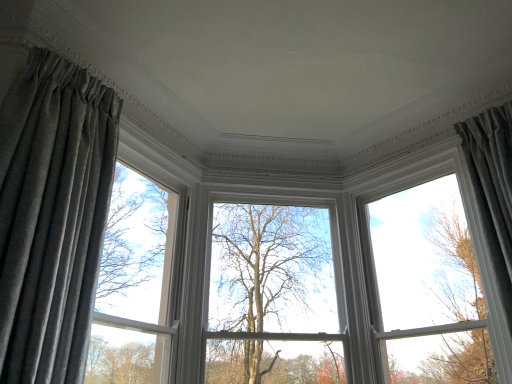
Question: Does matte gray curtain at left have a larger size compared to velvet gray curtain at left, the first curtain positioned from the left?

Choices:
 (A) no
 (B) yes

Answer: (A)

Question: Can we say matte gray curtain at left lies outside velvet gray curtain at left, which is counted as the 2th curtain, starting from the right?

Choices:
 (A) no
 (B) yes

Answer: (B)

Question: Does matte gray curtain at left have a greater width compared to velvet gray curtain at left, the first curtain positioned from the left?

Choices:
 (A) no
 (B) yes

Answer: (A)

Question: From the image's perspective, would you say matte gray curtain at left is positioned over velvet gray curtain at left, which is counted as the 2th curtain, starting from the right?

Choices:
 (A) no
 (B) yes

Answer: (A)

Question: Is matte gray curtain at left facing away from velvet gray curtain at left, the first curtain positioned from the left?

Choices:
 (A) yes
 (B) no

Answer: (B)

Question: Considering their positions, is matte gray curtain at left located in front of or behind white glossy window at upper center?

Choices:
 (A) behind
 (B) front

Answer: (B)

Question: From their relative heights in the image, would you say matte gray curtain at left is taller or shorter than white glossy window at upper center?

Choices:
 (A) short
 (B) tall

Answer: (B)

Question: Is matte gray curtain at left wider or thinner than white glossy window at upper center?

Choices:
 (A) thin
 (B) wide

Answer: (B)

Question: From a real-world perspective, relative to white glossy window at upper center, is matte gray curtain at left vertically above or below?

Choices:
 (A) below
 (B) above

Answer: (B)

Question: In terms of height, does white glossy window at upper center look taller or shorter compared to gray fabric curtain at right, the 2th curtain when ordered from left to right?

Choices:
 (A) tall
 (B) short

Answer: (A)

Question: Does point [410, 201] appear closer or farther from the camera than point [504, 155]?

Choices:
 (A) farther
 (B) closer

Answer: (A)

Question: Is white glossy window at upper center to the left or to the right of gray fabric curtain at right, the 2th curtain when ordered from left to right, in the image?

Choices:
 (A) right
 (B) left

Answer: (B)

Question: From a real-world perspective, is white glossy window at upper center positioned above or below gray fabric curtain at right, placed as the first curtain when sorted from right to left?

Choices:
 (A) below
 (B) above

Answer: (B)

Question: Is point (150, 258) closer or farther from the camera than point (66, 355)?

Choices:
 (A) farther
 (B) closer

Answer: (A)

Question: Is matte gray curtain at left wider or thinner than velvet gray curtain at left, the first curtain positioned from the left?

Choices:
 (A) thin
 (B) wide

Answer: (A)